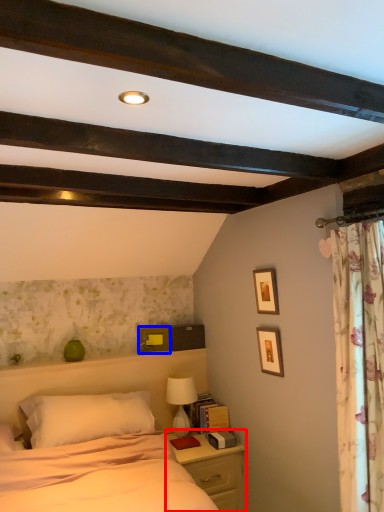
Question: Which object appears farthest to the camera in this image, nightstand (highlighted by a red box) or picture frame (highlighted by a blue box)?

Choices:
 (A) nightstand
 (B) picture frame

Answer: (B)